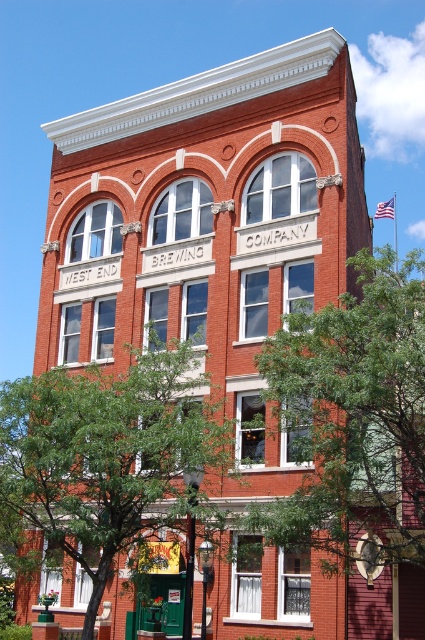
You are standing in front of the building and notice two green leafy trees. Which tree is closer to you, the green leafy tree at right or the green leafy tree at center?

The green leafy tree at right is closer to you because it is in front of the green leafy tree at center.

You are standing in front of the building and want to know which tree is wider. The green leafy tree at right or the green leafy tree at center?

The green leafy tree at center is wider than the green leafy tree at right.

You are standing in front of the building and want to walk to the green door. Which direction should you move relative to the green leafy tree at center and the green leafy tree at right?

You should move to the left of the green leafy tree at center and to the left of the green leafy tree at right because the green door is located at the bottom floor of the building, which is to the left of both trees.